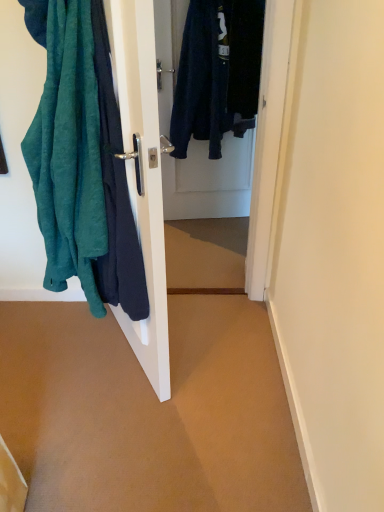
I want to click on vacant area that is in front of teal fabric at left, so tap(120, 424).